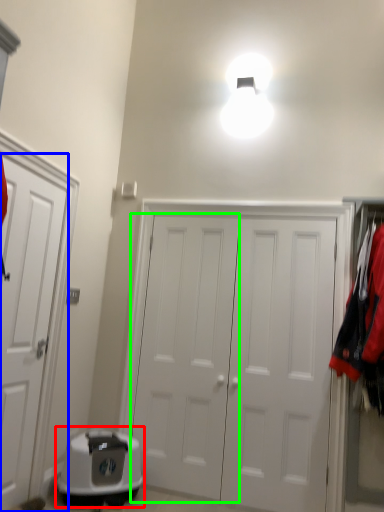
Question: Which object is the closest to the appliance (highlighted by a red box)? Choose among these: door (highlighted by a blue box) or door (highlighted by a green box).

Choices:
 (A) door
 (B) door

Answer: (B)